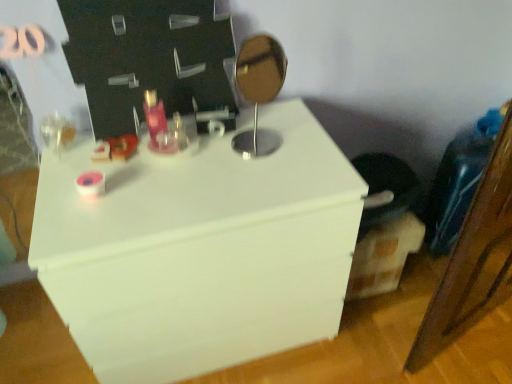
Question: Is matte pink glass at center wider than white matte dresser at center?

Choices:
 (A) no
 (B) yes

Answer: (A)

Question: Does matte pink glass at center lie in front of white matte dresser at center?

Choices:
 (A) no
 (B) yes

Answer: (A)

Question: Are matte pink glass at center and white matte dresser at center far apart?

Choices:
 (A) yes
 (B) no

Answer: (B)

Question: Considering the relative sizes of matte pink glass at center and white matte dresser at center in the image provided, is matte pink glass at center thinner than white matte dresser at center?

Choices:
 (A) no
 (B) yes

Answer: (B)

Question: Is matte pink glass at center bigger than white matte dresser at center?

Choices:
 (A) no
 (B) yes

Answer: (A)

Question: In terms of height, does matte pink glass at center look taller or shorter compared to metallic silver mirror at center?

Choices:
 (A) tall
 (B) short

Answer: (B)

Question: From a real-world perspective, is matte pink glass at center positioned above or below metallic silver mirror at center?

Choices:
 (A) above
 (B) below

Answer: (B)

Question: From the image's perspective, is matte pink glass at center above or below metallic silver mirror at center?

Choices:
 (A) above
 (B) below

Answer: (B)

Question: Is matte pink glass at center wider or thinner than metallic silver mirror at center?

Choices:
 (A) thin
 (B) wide

Answer: (A)

Question: Is metallic silver mirror at center spatially inside matte pink glass at center, or outside of it?

Choices:
 (A) outside
 (B) inside

Answer: (A)

Question: From the image's perspective, is metallic silver mirror at center located above or below matte pink glass at center?

Choices:
 (A) below
 (B) above

Answer: (B)

Question: In the image, is metallic silver mirror at center positioned in front of or behind matte pink glass at center?

Choices:
 (A) front
 (B) behind

Answer: (A)

Question: Does point (253, 62) appear closer or farther from the camera than point (151, 132)?

Choices:
 (A) closer
 (B) farther

Answer: (B)

Question: From the image's perspective, is matte pink glass at center located above or below white matte dresser at center?

Choices:
 (A) above
 (B) below

Answer: (A)

Question: Relative to white matte dresser at center, is matte pink glass at center in front or behind?

Choices:
 (A) behind
 (B) front

Answer: (A)